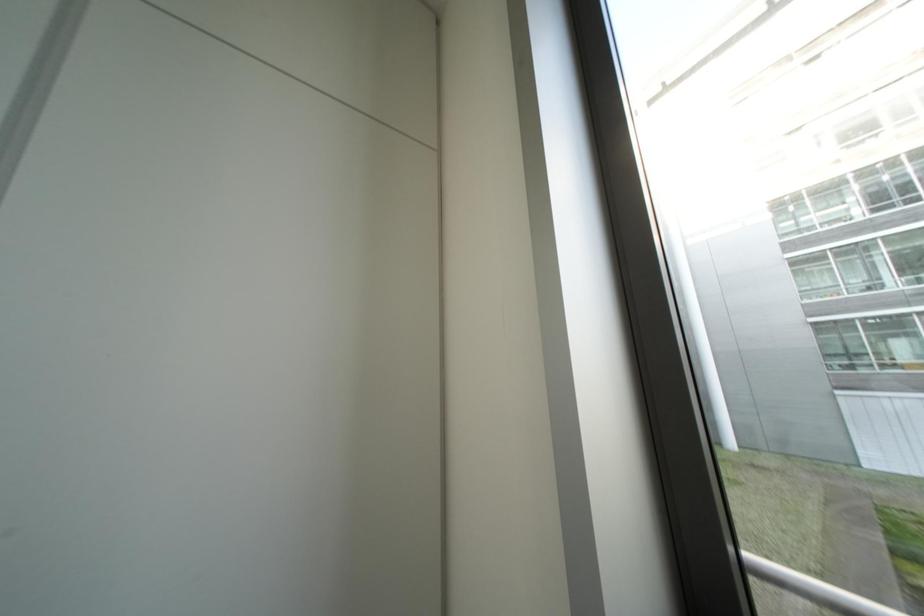
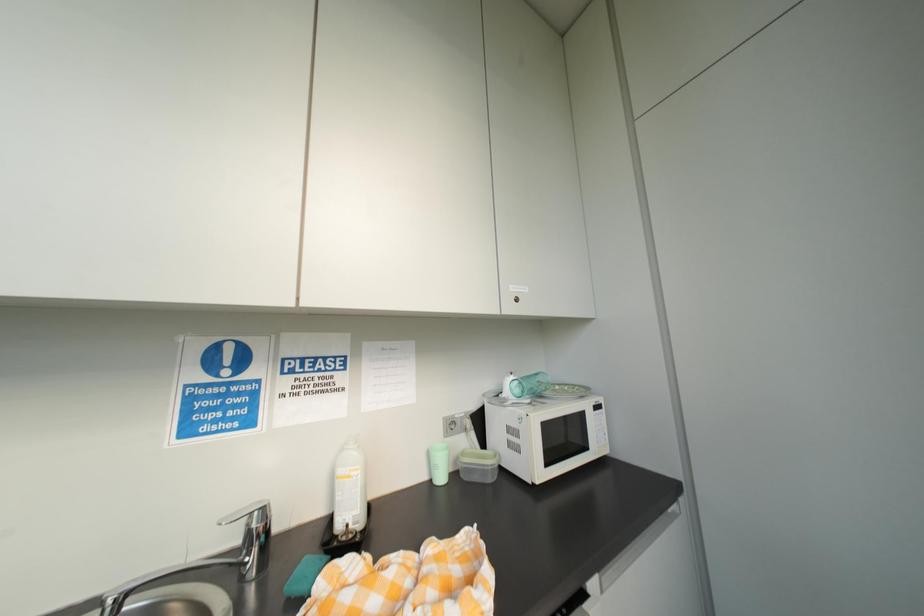
Question: The first image is from the beginning of the video and the second image is from the end. How did the camera likely rotate when shooting the video?

Choices:
 (A) Left
 (B) Right
 (C) Up
 (D) Down

Answer: (A)